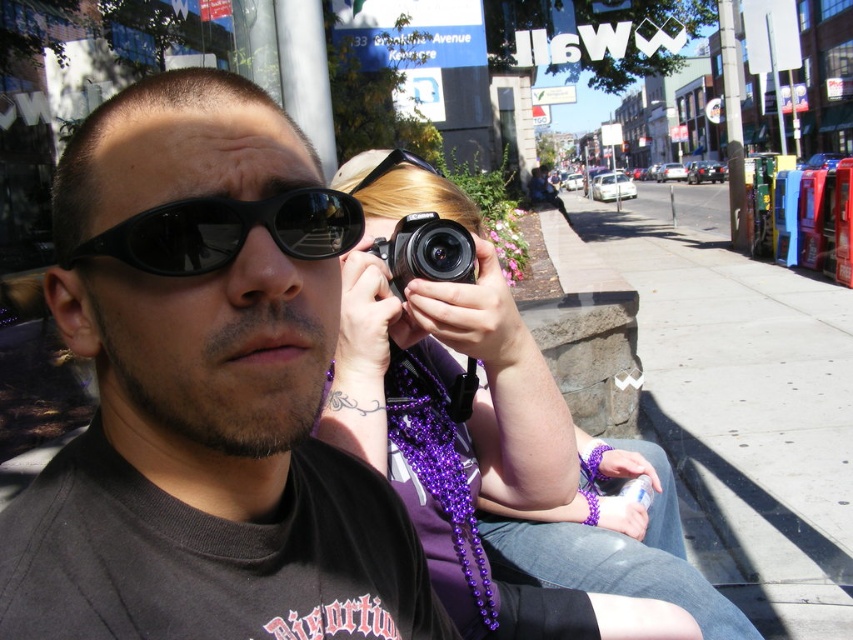
You are a photographer trying to capture a closeup of the matte black sunglasses at center and the purple beaded necklace at center. Which object is covering the other one in the image?

The matte black sunglasses at center is positioned over the purple beaded necklace at center, so the sunglasses are covering the necklace.

You are a delivery robot with a 12 inch wide package. You need to pass between the matte black sunglasses at center and the black plastic camera at center. Can you fit through the space between them?

The matte black sunglasses at center and black plastic camera at center are 20.89 inches apart from each other. Since your package is 12 inches wide, there is sufficient space to fit through the gap between them.